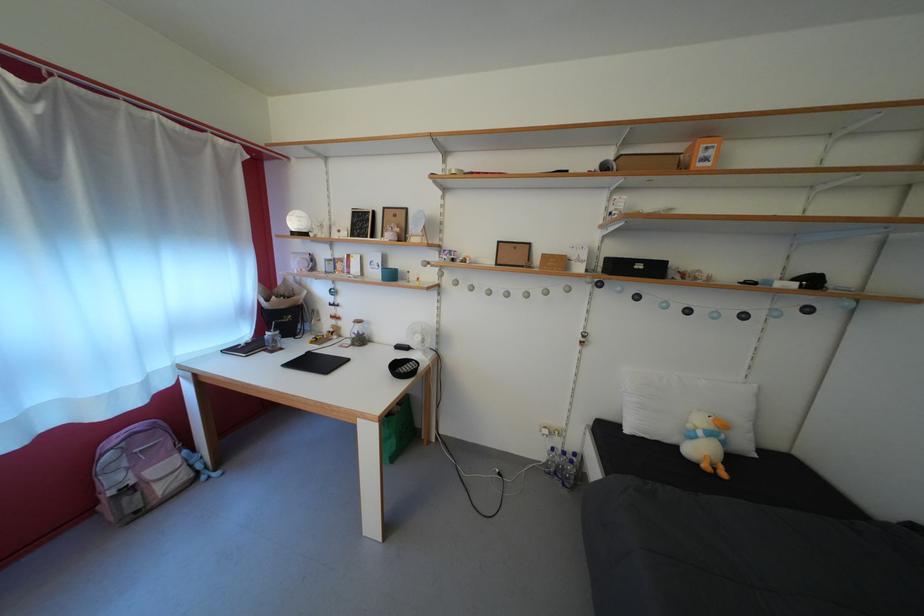
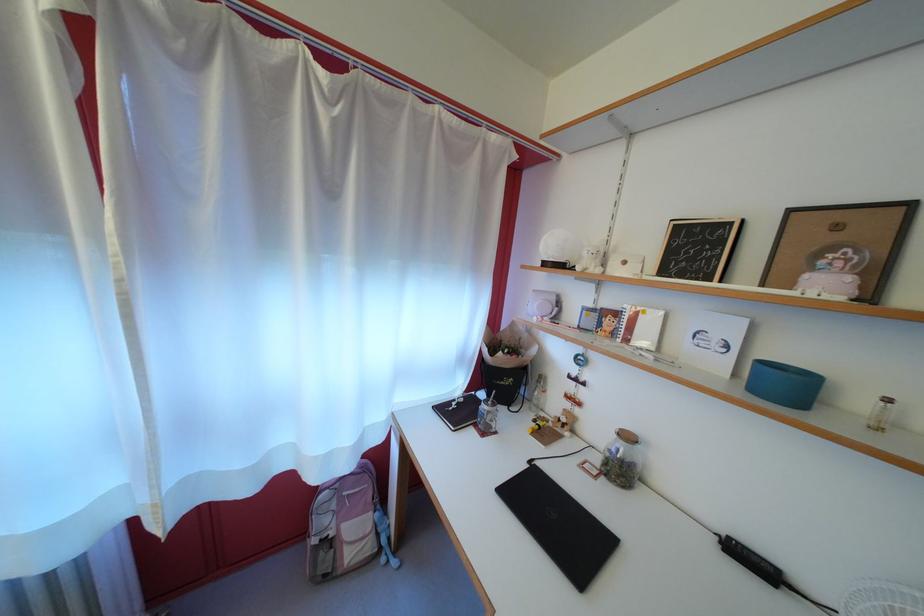
Question: Based on the continuous images, in which direction is the camera rotating? Reply with the corresponding letter.

Choices:
 (A) Left
 (B) Right
 (C) Up
 (D) Down

Answer: (A)